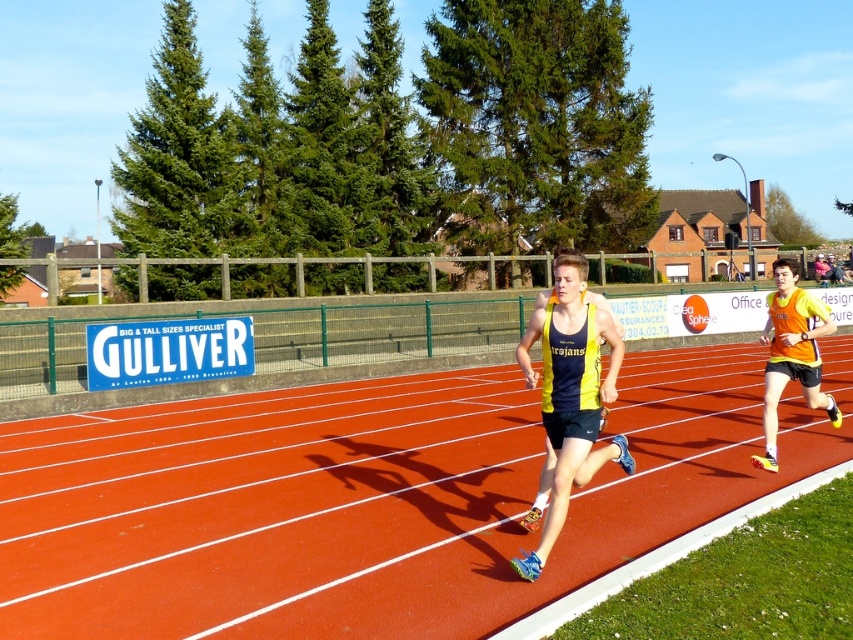
Question: Is red rubber track at center further to the viewer compared to orange/yellow jersey at right?

Choices:
 (A) yes
 (B) no

Answer: (B)

Question: Which object appears farthest from the camera in this image?

Choices:
 (A) red rubber track at center
 (B) orange/yellow jersey at right
 (C) yellow-green jersey at center

Answer: (B)

Question: Can you confirm if yellow-green jersey at center is thinner than orange/yellow jersey at right?

Choices:
 (A) yes
 (B) no

Answer: (A)

Question: Can you confirm if yellow-green jersey at center is positioned above orange/yellow jersey at right?

Choices:
 (A) no
 (B) yes

Answer: (A)

Question: Which of these objects is positioned closest to the red rubber track at center?

Choices:
 (A) orange/yellow jersey at right
 (B) yellow-green jersey at center

Answer: (B)

Question: Which point is farther to the camera?

Choices:
 (A) (608, 444)
 (B) (579, 550)

Answer: (A)